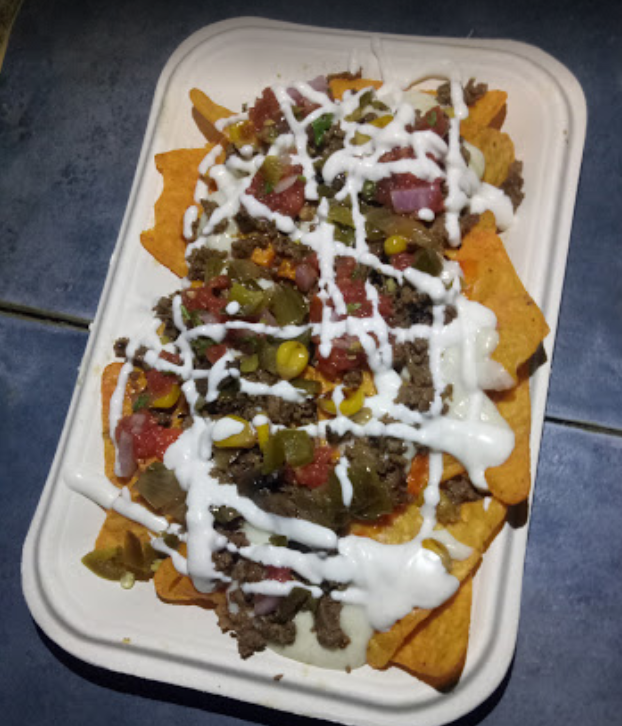
Image resolution: width=622 pixels, height=726 pixels. Identify the location of counter. (16, 382), (39, 687), (581, 616), (593, 393), (596, 30).